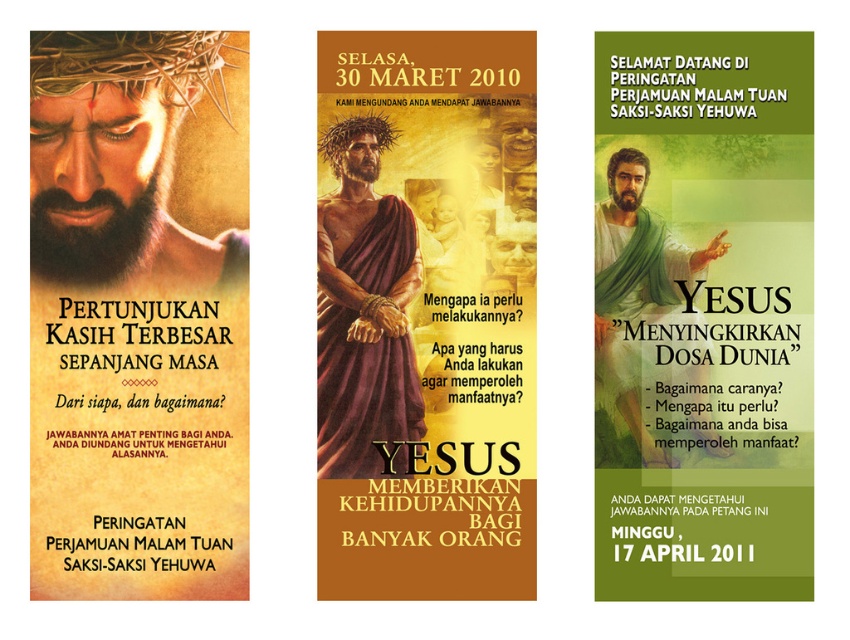
Is point (179, 576) positioned before point (352, 426)?

That is False.

Consider the image. Between matte black face at upper left and maroon fabric draped at center, which one appears on the left side from the viewer's perspective?

matte black face at upper left is more to the left.

Between point (144, 189) and point (414, 282), which one is positioned in front?

Point (414, 282)

At what (x,y) coordinates should I click in order to perform the action: click on matte black face at upper left. Please return your answer as a coordinate pair (x, y). This screenshot has width=850, height=640. Looking at the image, I should click on (139, 316).

Which is behind, point (54, 273) or point (350, 164)?

The point (54, 273) is behind.

Is point (31, 132) more distant than point (378, 248)?

Yes, point (31, 132) is behind point (378, 248).

This screenshot has width=850, height=640. I want to click on matte gold crown of thorns at upper left, so click(120, 156).

Is matte black face at upper left positioned behind green cloth at center?

Yes, matte black face at upper left is behind green cloth at center.

Which of these two, matte black face at upper left or green cloth at center, stands shorter?

Standing shorter between the two is matte black face at upper left.

Which is behind, point (68, 394) or point (635, 371)?

Positioned behind is point (68, 394).

Where is `matte black face at upper left`? This screenshot has width=850, height=640. matte black face at upper left is located at coordinates [x=139, y=316].